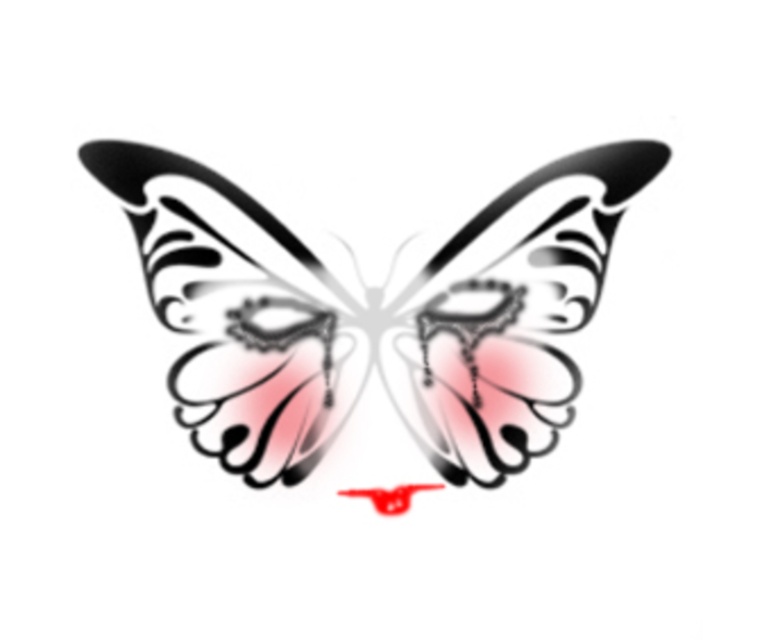
Can you confirm if translucent paper butterfly at center is smaller than black glossy wing at center?

No, translucent paper butterfly at center is not smaller than black glossy wing at center.

Does translucent paper butterfly at center come behind black glossy wing at center?

That is True.

Who is more forward, (237,464) or (126,193)?

Positioned in front is point (126,193).

This screenshot has height=640, width=771. I want to click on translucent paper butterfly at center, so click(x=372, y=314).